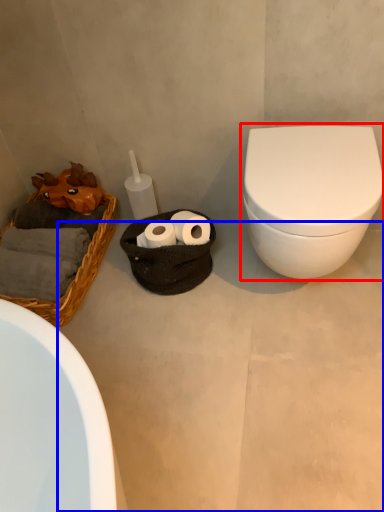
Question: Which point is closer to the camera, toilet (highlighted by a red box) or concrete (highlighted by a blue box)?

Choices:
 (A) toilet
 (B) concrete

Answer: (B)